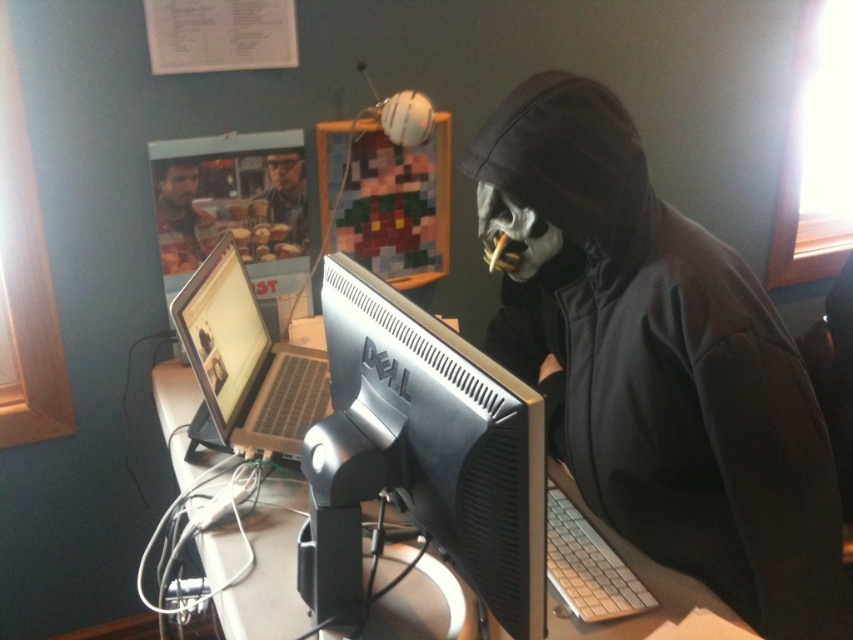
What do you see at coordinates (180, 216) in the screenshot? Image resolution: width=853 pixels, height=640 pixels. I see `smooth skin face at upper left` at bounding box center [180, 216].

The height and width of the screenshot is (640, 853). I want to click on smooth skin face at upper left, so click(180, 216).

Is matte gray desk at center smaller than silver metallic laptop at left?

No, matte gray desk at center is not smaller than silver metallic laptop at left.

Does point (572, 500) come farther from viewer compared to point (231, 413)?

That is False.

Where is `matte gray desk at center`? The image size is (853, 640). matte gray desk at center is located at coordinates (267, 570).

The image size is (853, 640). Describe the element at coordinates (267, 570) in the screenshot. I see `matte gray desk at center` at that location.

Can you confirm if matte gray desk at center is positioned above smooth skin face at upper left?

Incorrect, matte gray desk at center is not positioned above smooth skin face at upper left.

At what (x,y) coordinates should I click in order to perform the action: click on matte gray desk at center. Please return your answer as a coordinate pair (x, y). The image size is (853, 640). Looking at the image, I should click on (267, 570).

Locate an element on the screen. matte gray desk at center is located at coordinates (267, 570).